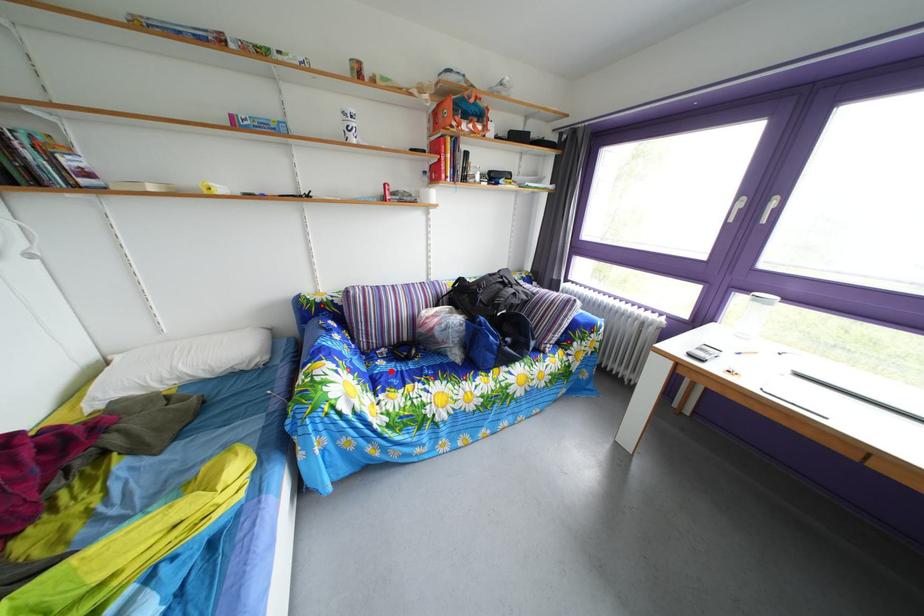
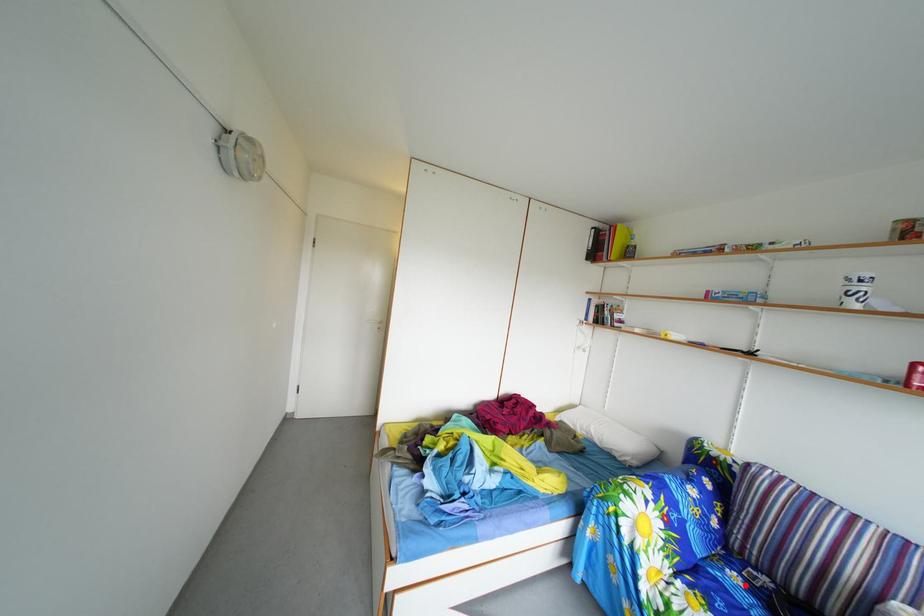
I am providing you with two images of the same scene from different viewpoints. A red point is marked on the first image and another point is marked on the second image. Do the highlighted points in image1 and image2 indicate the same real-world spot?

Yes